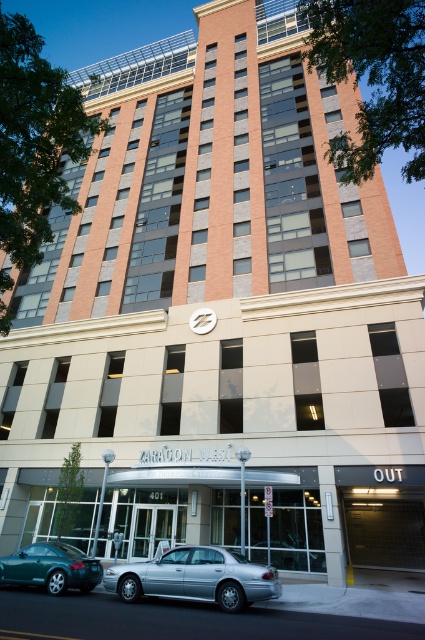
You are a delivery driver approaching the entrance of Zaragon West. You see a silver metallic sedan at lower center and a green matte car at lower left. Which car is closer to the entrance?

The silver metallic sedan at lower center is closer to the entrance because it is located above the green matte car at lower left, meaning it is positioned nearer to the entrance area.

You are standing at the entrance of Zaragon West building and want to reach the point marked at coordinates point (214, 576). Given that the distance between you and the point is 30.14 feet, can you estimate how far you need to walk to reach it?

The distance between you and the point (214, 576) is 30.14 feet, so you need to walk approximately 30.14 feet to reach it.

You are a delivery driver approaching the entrance of Zaragon West. You see a silver metallic sedan at lower center and a green matte car at lower left. Which car is blocking your path to the entrance?

The silver metallic sedan at lower center is blocking your path to the entrance because it is in front of the green matte car at lower left, which is closer to the entrance area.